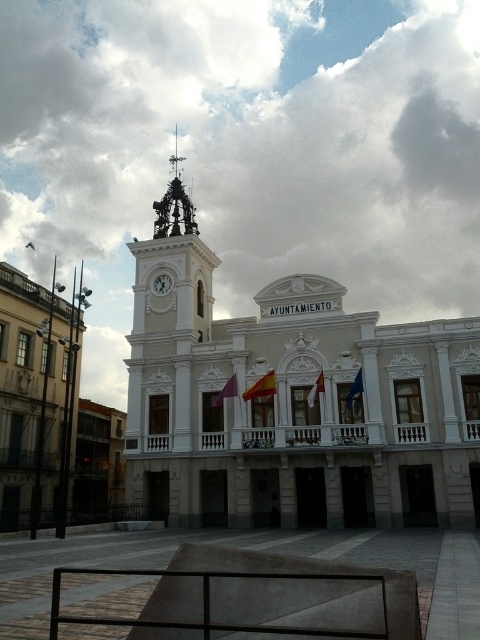
You are an architect visiting the AYUNTAMIENTO building. You notice the red fabric flag at center and the white glossy clock at upper left. Which object appears larger in the image?

The white glossy clock at upper left appears larger than the red fabric flag at center.

You are standing in front of the AYUNTAMIENTO building and want to take a photo of the white stone building at center and the white glossy clock at upper left. Which object should you focus on first to ensure both are in the frame?

You should focus on the white stone building at center first because it is in front of the white glossy clock at upper left, so adjusting the camera to include the building will naturally include the clock in the background.